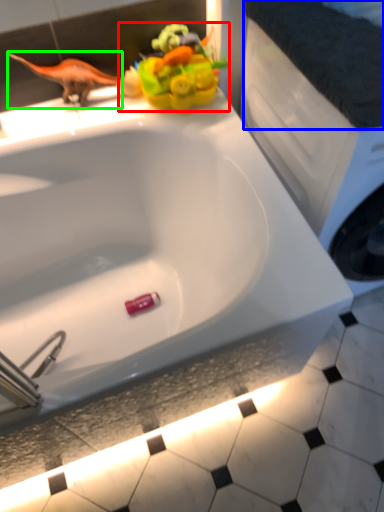
Question: Which object is positioned closest to toy (highlighted by a red box)? Select from counter top (highlighted by a blue box) and animal (highlighted by a green box).

Choices:
 (A) counter top
 (B) animal

Answer: (B)